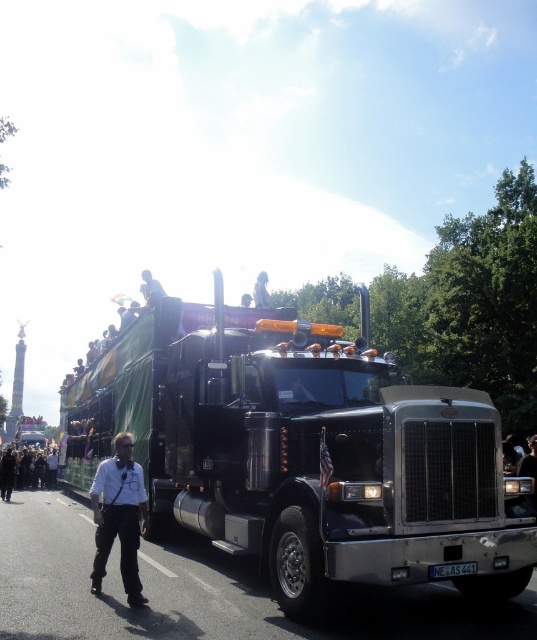
Question: Is white shirt at center further to camera compared to white fabric at upper center?

Choices:
 (A) no
 (B) yes

Answer: (A)

Question: Which point appears farthest from the camera in this image?

Choices:
 (A) (37, 477)
 (B) (105, 573)
 (C) (257, 291)

Answer: (A)

Question: Can you confirm if dark gray pants at lower left is thinner than white fabric at upper center?

Choices:
 (A) no
 (B) yes

Answer: (A)

Question: Considering the relative positions of shiny black truck at center and white fabric at upper center in the image provided, where is shiny black truck at center located with respect to white fabric at upper center?

Choices:
 (A) above
 (B) below

Answer: (B)

Question: Which point appears closest to the camera in this image?

Choices:
 (A) (267, 307)
 (B) (1, 492)
 (C) (120, 484)

Answer: (C)

Question: Which object appears closest to the camera in this image?

Choices:
 (A) white shirt at center
 (B) white fabric at upper center
 (C) shiny black truck at center

Answer: (C)